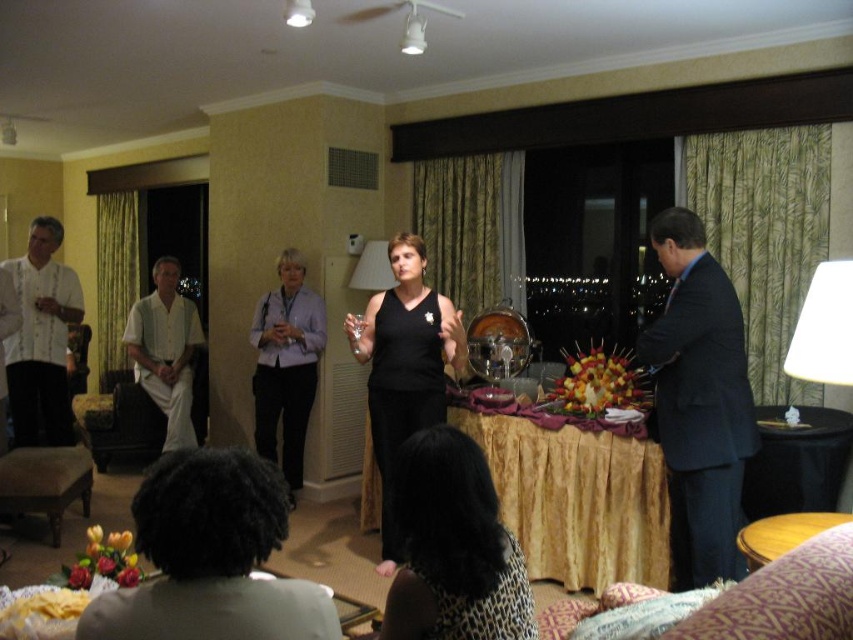
Between white cotton shirt at left and wooden table at lower right, which one has more height?

white cotton shirt at left

Between point (180, 300) and point (792, 544), which one is positioned behind?

The point (180, 300) is behind.

Is point (132, 330) less distant than point (805, 524)?

No, it is not.

Where is `white cotton shirt at left`? white cotton shirt at left is located at coordinates (165, 349).

Which is in front, point (532, 454) or point (378, 444)?

Point (378, 444) is in front.

Does gold fabric table at center appear on the left side of black matte dress at center?

A: In fact, gold fabric table at center is to the right of black matte dress at center.

Where is `gold fabric table at center`? Image resolution: width=853 pixels, height=640 pixels. gold fabric table at center is located at coordinates pos(573,492).

Is point (241, 524) positioned behind point (306, 385)?

No, (241, 524) is closer to viewer.

From the picture: Is dark gray shirt at lower left to the left of light purple shirt at center from the viewer's perspective?

In fact, dark gray shirt at lower left is to the right of light purple shirt at center.

Where is `dark gray shirt at lower left`? The height and width of the screenshot is (640, 853). dark gray shirt at lower left is located at coordinates (210, 557).

This screenshot has width=853, height=640. Find the location of `dark gray shirt at lower left`. dark gray shirt at lower left is located at coordinates (210, 557).